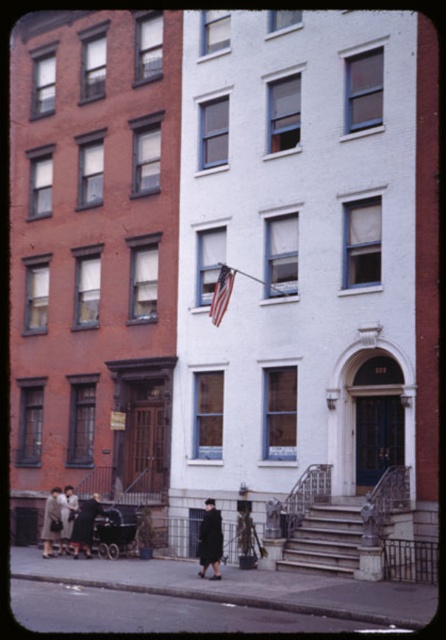
Question: Which is farther from the black wool coat at center?

Choices:
 (A) matte gray coat at lower left
 (B) american flag at center

Answer: (A)

Question: Based on their relative distances, which object is nearer to the matte gray coat at lower left?

Choices:
 (A) american flag at center
 (B) matte black coat at lower left
 (C) dark brown leather coat at lower left

Answer: (B)

Question: Which object is closer to the camera taking this photo?

Choices:
 (A) matte black coat at lower left
 (B) black wool coat at center
 (C) matte gray coat at lower left

Answer: (B)

Question: Is american flag at center wider than matte black coat at lower left?

Choices:
 (A) no
 (B) yes

Answer: (B)

Question: Does black wool coat at center appear on the left side of american flag at center?

Choices:
 (A) yes
 (B) no

Answer: (A)

Question: Does dark brown leather coat at lower left appear over matte gray coat at lower left?

Choices:
 (A) no
 (B) yes

Answer: (B)